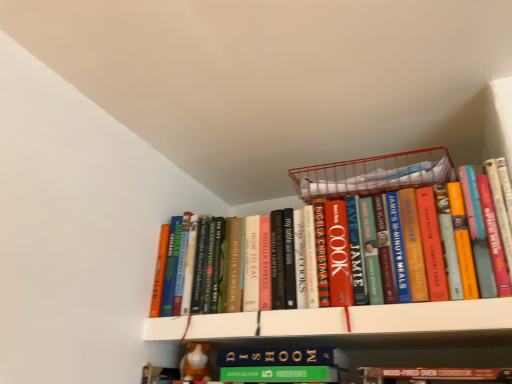
Question: Considering the positions of metallic wire basket at upper center and hardcover books at center in the image, is metallic wire basket at upper center wider or thinner than hardcover books at center?

Choices:
 (A) wide
 (B) thin

Answer: (A)

Question: From a real-world perspective, is metallic wire basket at upper center above or below hardcover books at center?

Choices:
 (A) above
 (B) below

Answer: (A)

Question: Which object is the closest to the metallic wire basket at upper center?

Choices:
 (A) white matte bookshelf at upper center
 (B) orange fabric dog at lower center
 (C) hardcover books at center

Answer: (C)

Question: Which of these objects is positioned closest to the hardcover books at center?

Choices:
 (A) white matte bookshelf at upper center
 (B) orange fabric dog at lower center
 (C) metallic wire basket at upper center

Answer: (C)